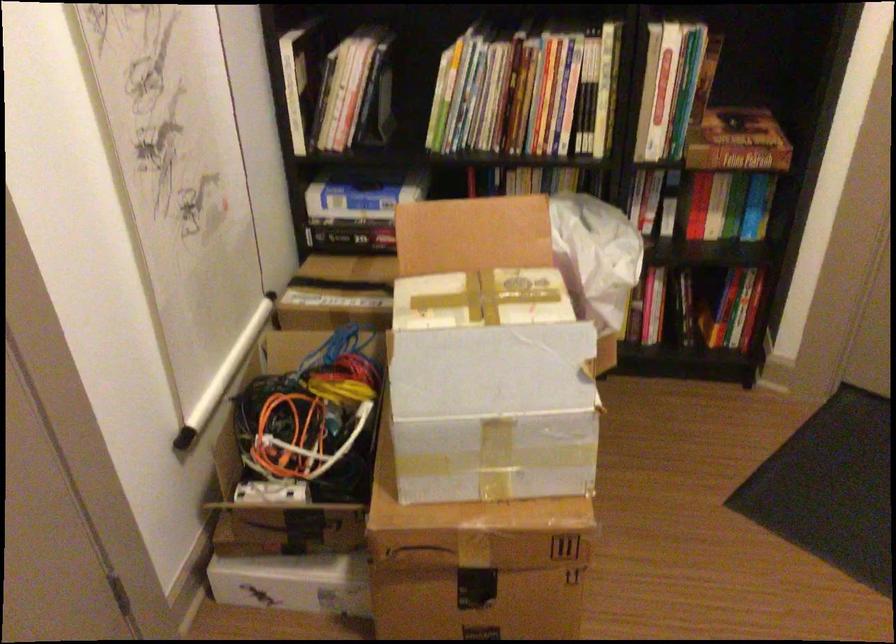
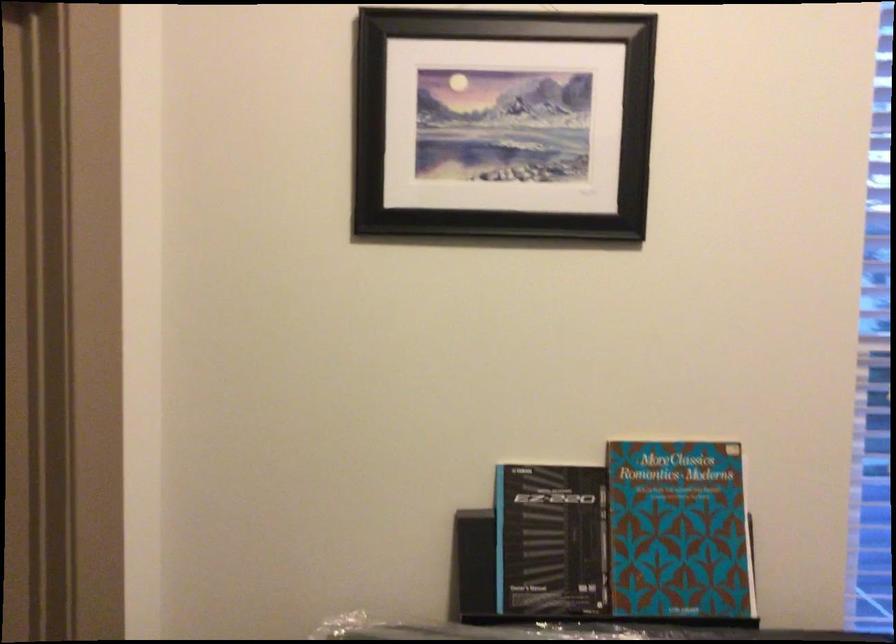
Question: The camera is either moving clockwise (left) or counter-clockwise (right) around the object. The first image is from the beginning of the video and the second image is from the end. Is the camera moving left or right when shooting the video?

Choices:
 (A) Left
 (B) Right

Answer: (A)